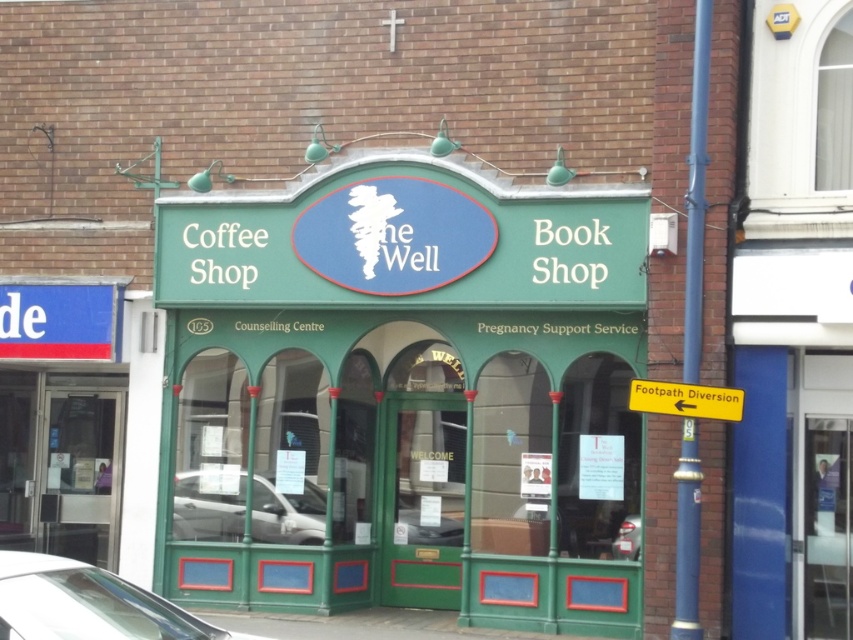
You are a GUI agent. You are given a task and a screenshot of the screen. Output one action in this format:
    pyautogui.click(x=<x>, y=<y>)
    Task: Click on the green painted wood at center
    Image resolution: width=853 pixels, height=640 pixels.
    Given the screenshot: What is the action you would take?
    pyautogui.click(x=401, y=392)

Consider the image. Which is above, green painted wood at center or white glossy car at lower left?

Positioned higher is green painted wood at center.

Is point (236, 556) less distant than point (30, 611)?

No, it is not.

This screenshot has height=640, width=853. What are the coordinates of `green painted wood at center` in the screenshot? It's located at (401, 392).

Which is more to the right, silver metallic car at center or yellow plastic sign at right?

Positioned to the right is yellow plastic sign at right.

Which is in front, point (201, 536) or point (740, 394)?

Positioned in front is point (740, 394).

Does point (192, 506) lie in front of point (686, 384)?

No, it is behind (686, 384).

I want to click on silver metallic car at center, so click(286, 513).

At what (x,y) coordinates should I click in order to perform the action: click on white glossy car at lower left. Please return your answer as a coordinate pair (x, y). Image resolution: width=853 pixels, height=640 pixels. Looking at the image, I should click on (86, 604).

Locate an element on the screen. white glossy car at lower left is located at coordinates (86, 604).